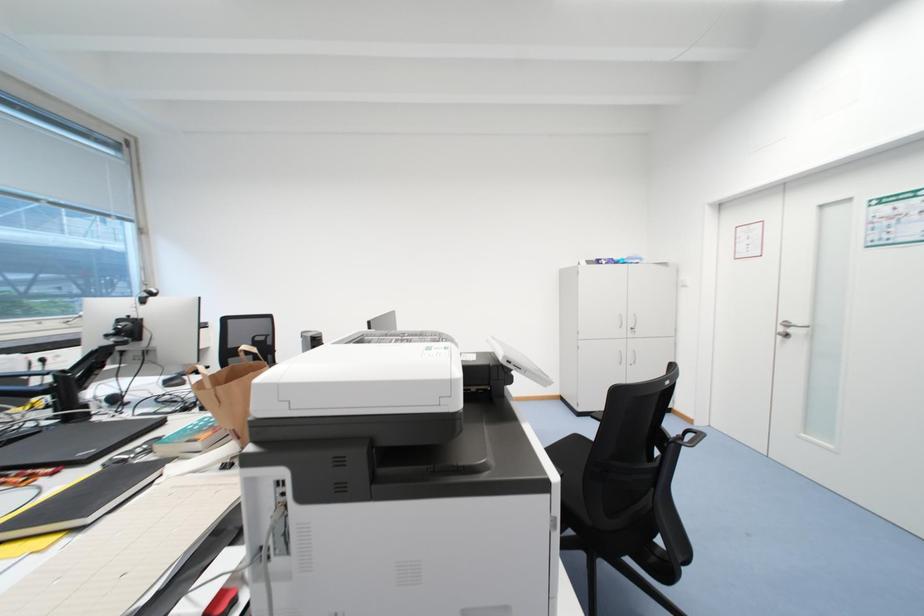
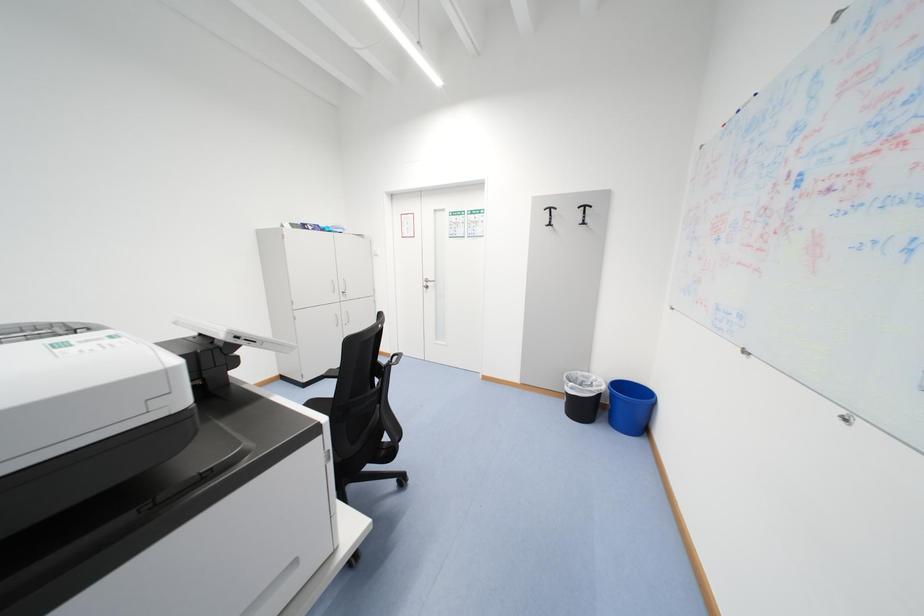
Question: The camera is either moving clockwise (left) or counter-clockwise (right) around the object. The first image is from the beginning of the video and the second image is from the end. Is the camera moving left or right when shooting the video?

Choices:
 (A) Left
 (B) Right

Answer: (A)